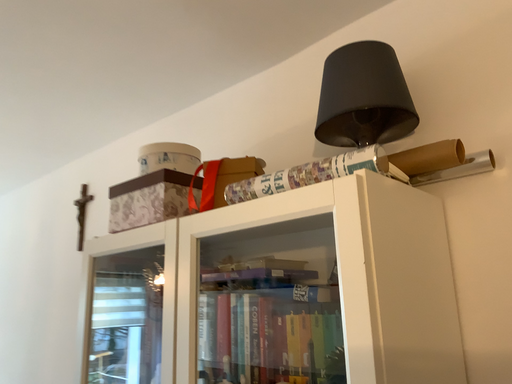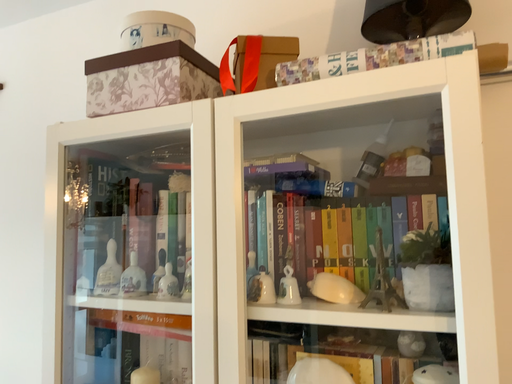
Question: How did the camera likely rotate when shooting the video?

Choices:
 (A) rotated upward
 (B) rotated downward

Answer: (B)